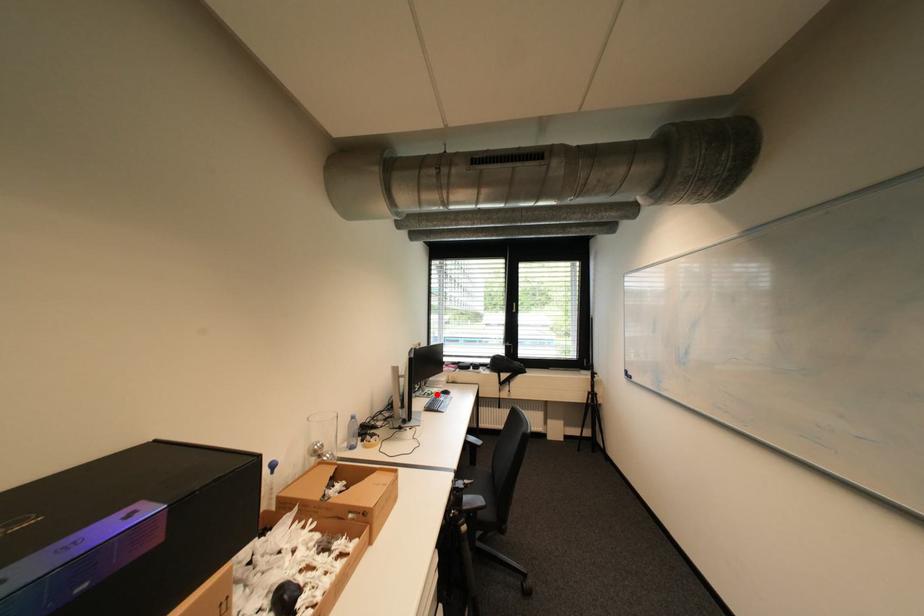
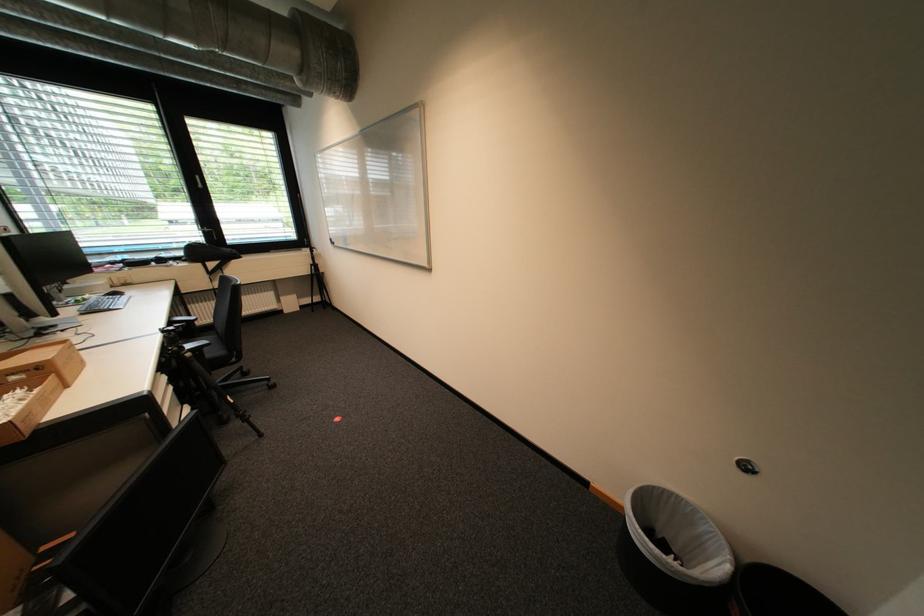
Where in the second image is the point corresponding to the highlighted location from the first image?

(86, 302)